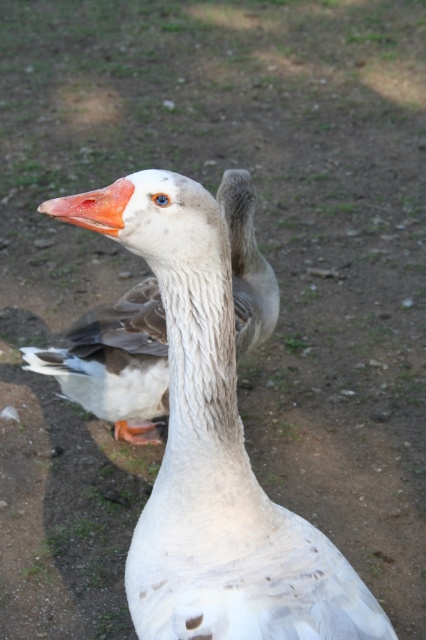
You are a photographer trying to capture a closeup of the white feathered goose at center and the orange matte beak at center in the image. Your camera can only focus on objects within a 4 feet range. Can both objects be in focus simultaneously?

The white feathered goose at center and orange matte beak at center are 4.69 feet apart from each other. Since the distance between them exceeds the camera focus range of 4 feet, they cannot both be in focus at the same time.

You are a birdwatcher trying to identify two birds in the image. You notice both a white feathered duck at center and a white feathered goose at center. Which one is smaller in size?

The white feathered duck at center is smaller in size compared to the white feathered goose at center.

You are a birdwatcher trying to observe the orange matte beak at center and the white feathered goose at center. Which one is closer to you?

The white feathered goose at center is closer to you because the orange matte beak at center is behind it.